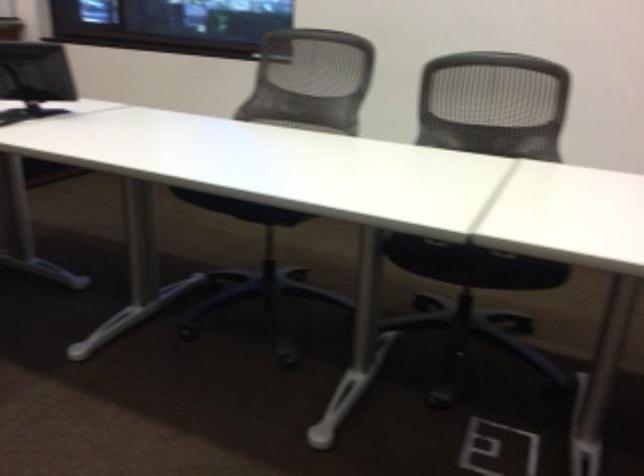
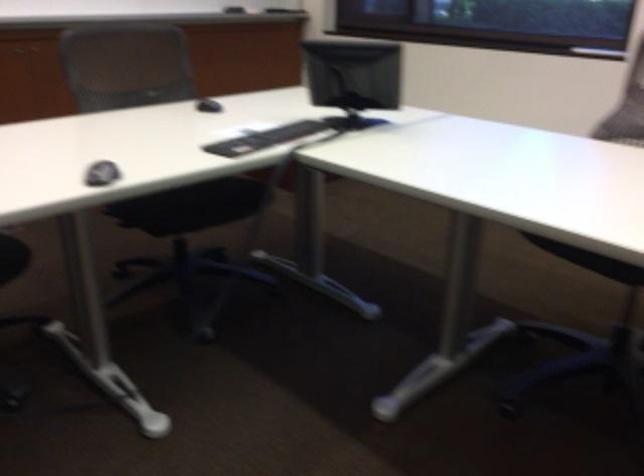
Question: The first image is from the beginning of the video and the second image is from the end. How did the camera likely rotate when shooting the video?

Choices:
 (A) Left
 (B) Right
 (C) Up
 (D) Down

Answer: (A)